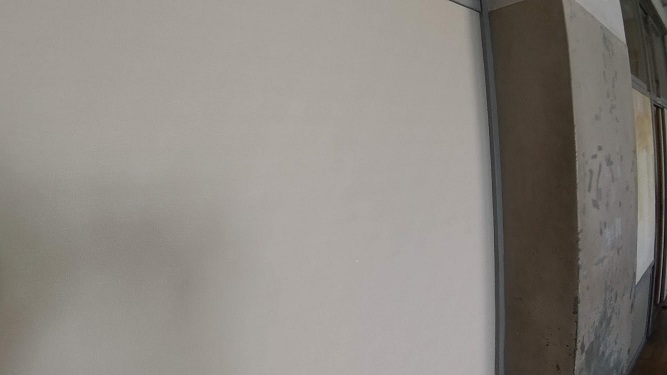
Identify the location of brown tiled floor. Image resolution: width=667 pixels, height=375 pixels. (658, 370).